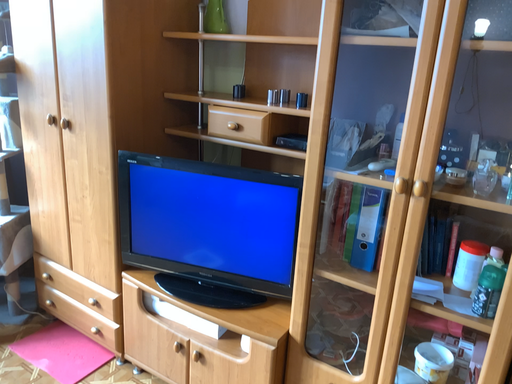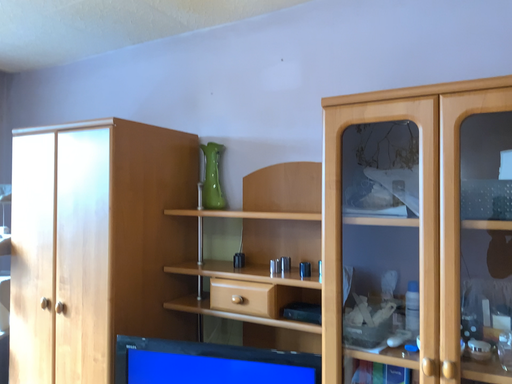
Question: Which way did the camera rotate in the video?

Choices:
 (A) rotated downward
 (B) rotated upward

Answer: (B)